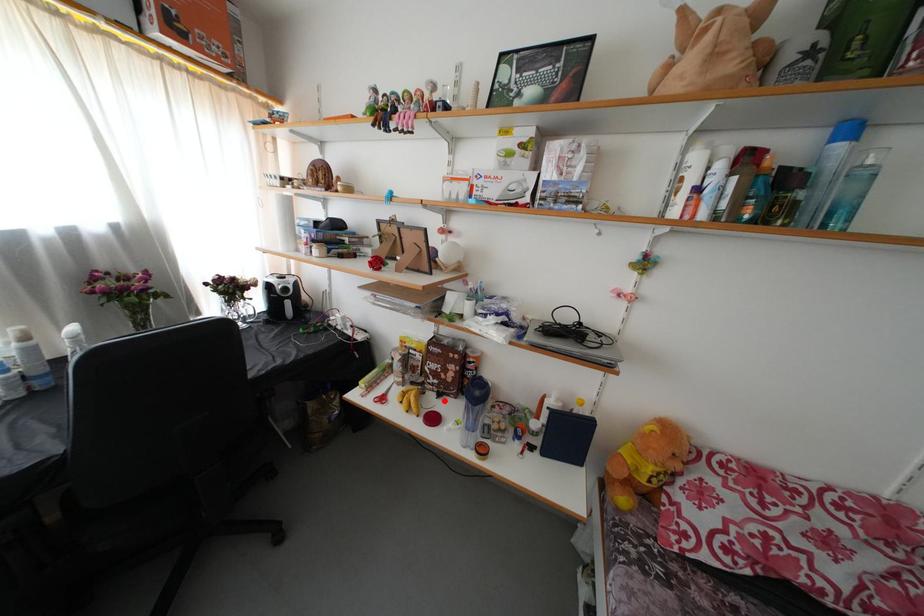
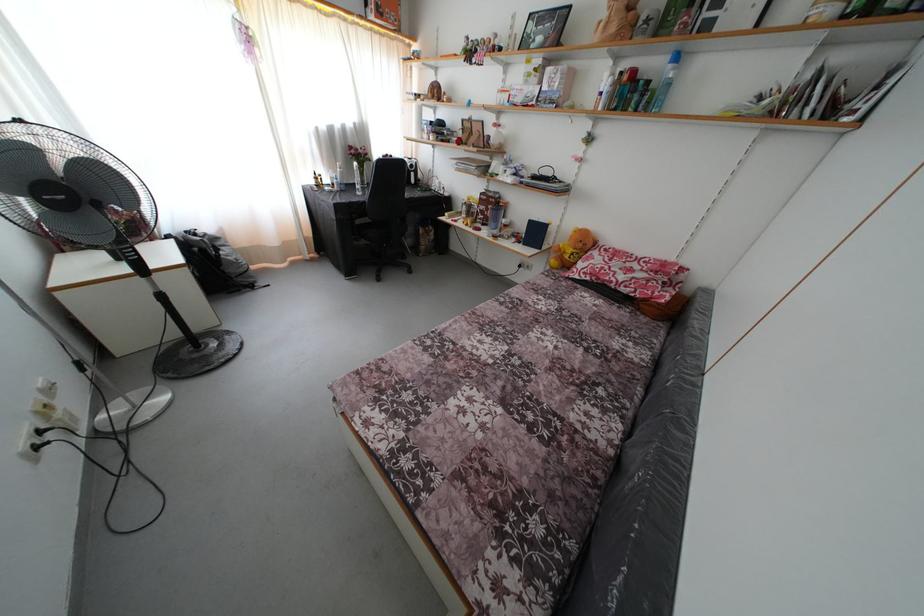
Question: I am providing you with two images of the same scene from different viewpoints. In image1, a red point is highlighted. Considering the same 3D point in image2, which of the following is correct?

Choices:
 (A) It is closer
 (B) It is farther

Answer: (A)